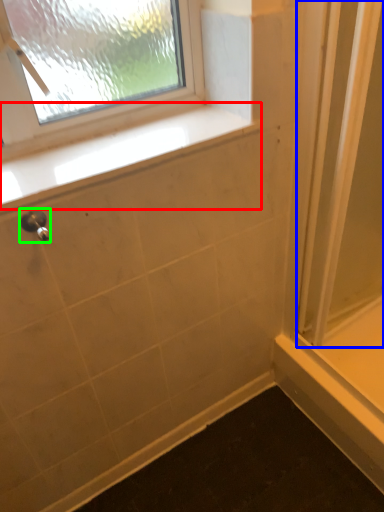
Question: Which object is the closest to the window sill (highlighted by a red box)? Choose among these: screen door (highlighted by a blue box) or shower (highlighted by a green box).

Choices:
 (A) screen door
 (B) shower

Answer: (B)